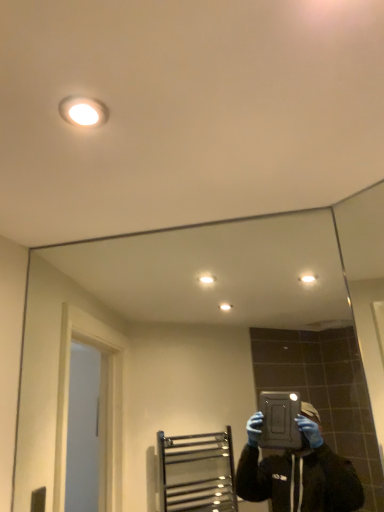
At what (x,y) coordinates should I click in order to perform the action: click on clear glass mirror at center. Please return your answer as a coordinate pair (x, y). Looking at the image, I should click on (191, 345).

What do you see at coordinates (191, 345) in the screenshot? I see `clear glass mirror at center` at bounding box center [191, 345].

This screenshot has height=512, width=384. What do you see at coordinates (83, 111) in the screenshot?
I see `white glossy light fixture at upper center` at bounding box center [83, 111].

What is the approximate height of white glossy light fixture at upper center?

0.78 inches.

Consider the image. What is the approximate width of white glossy light fixture at upper center?

white glossy light fixture at upper center is 3.32 inches wide.

The height and width of the screenshot is (512, 384). In order to click on white glossy light fixture at upper center in this screenshot , I will do pos(83,111).

Locate an element on the screen. The image size is (384, 512). clear glass mirror at center is located at coordinates (191, 345).

Can you confirm if white glossy light fixture at upper center is positioned to the right of clear glass mirror at center?

In fact, white glossy light fixture at upper center is to the left of clear glass mirror at center.

Is white glossy light fixture at upper center further to camera compared to clear glass mirror at center?

No, white glossy light fixture at upper center is closer to the camera.

Considering the points (85, 109) and (308, 334), which point is behind, point (85, 109) or point (308, 334)?

Point (308, 334)

From the image's perspective, is white glossy light fixture at upper center located above or below clear glass mirror at center?

Based on their image positions, white glossy light fixture at upper center is located above clear glass mirror at center.

From a real-world perspective, is white glossy light fixture at upper center located beneath clear glass mirror at center?

No, from a real-world perspective, white glossy light fixture at upper center is not under clear glass mirror at center.

Consider the image. Which of these two, white glossy light fixture at upper center or clear glass mirror at center, is wider?

Wider between the two is white glossy light fixture at upper center.

Considering the sizes of white glossy light fixture at upper center and clear glass mirror at center in the image, is white glossy light fixture at upper center taller or shorter than clear glass mirror at center?

Considering their sizes, white glossy light fixture at upper center has less height than clear glass mirror at center.

Considering the sizes of objects white glossy light fixture at upper center and clear glass mirror at center in the image provided, who is smaller, white glossy light fixture at upper center or clear glass mirror at center?

Smaller between the two is white glossy light fixture at upper center.

Is white glossy light fixture at upper center not within clear glass mirror at center?

That's correct, white glossy light fixture at upper center is outside of clear glass mirror at center.

Is white glossy light fixture at upper center positioned far away from clear glass mirror at center?

That's not correct — white glossy light fixture at upper center is a little close to clear glass mirror at center.

Is white glossy light fixture at upper center turned away from clear glass mirror at center?

No.

How different are the orientations of white glossy light fixture at upper center and clear glass mirror at center in degrees?

41.4 degrees separate the facing orientations of white glossy light fixture at upper center and clear glass mirror at center.

This screenshot has height=512, width=384. I want to click on mirror located on the right of white glossy light fixture at upper center, so click(x=191, y=345).

Is clear glass mirror at center to the right of white glossy light fixture at upper center from the viewer's perspective?

Indeed, clear glass mirror at center is positioned on the right side of white glossy light fixture at upper center.

Does clear glass mirror at center lie in front of white glossy light fixture at upper center?

No, clear glass mirror at center is further to the viewer.

Is point (213, 305) positioned after point (84, 101)?

Yes, it is.

From the image's perspective, between clear glass mirror at center and white glossy light fixture at upper center, which one is located above?

white glossy light fixture at upper center, from the image's perspective.

From a real-world perspective, is clear glass mirror at center positioned under white glossy light fixture at upper center based on gravity?

Indeed, from a real-world perspective, clear glass mirror at center is positioned beneath white glossy light fixture at upper center.

Is clear glass mirror at center thinner than white glossy light fixture at upper center?

Yes.

Between clear glass mirror at center and white glossy light fixture at upper center, which one has less height?

white glossy light fixture at upper center.

Does clear glass mirror at center have a larger size compared to white glossy light fixture at upper center?

Yes, clear glass mirror at center is bigger than white glossy light fixture at upper center.

Does clear glass mirror at center contain white glossy light fixture at upper center?

No.

Are clear glass mirror at center and white glossy light fixture at upper center beside each other?

No.

Is clear glass mirror at center oriented towards white glossy light fixture at upper center?

Yes, clear glass mirror at center is aimed at white glossy light fixture at upper center.

There is a clear glass mirror at center. Identify the location of light fixture above it (from a real-world perspective). click(83, 111).

At what (x,y) coordinates should I click in order to perform the action: click on mirror that is on the right side of white glossy light fixture at upper center. Please return your answer as a coordinate pair (x, y). The image size is (384, 512). Looking at the image, I should click on (191, 345).

I want to click on mirror below the white glossy light fixture at upper center (from the image's perspective), so (191, 345).